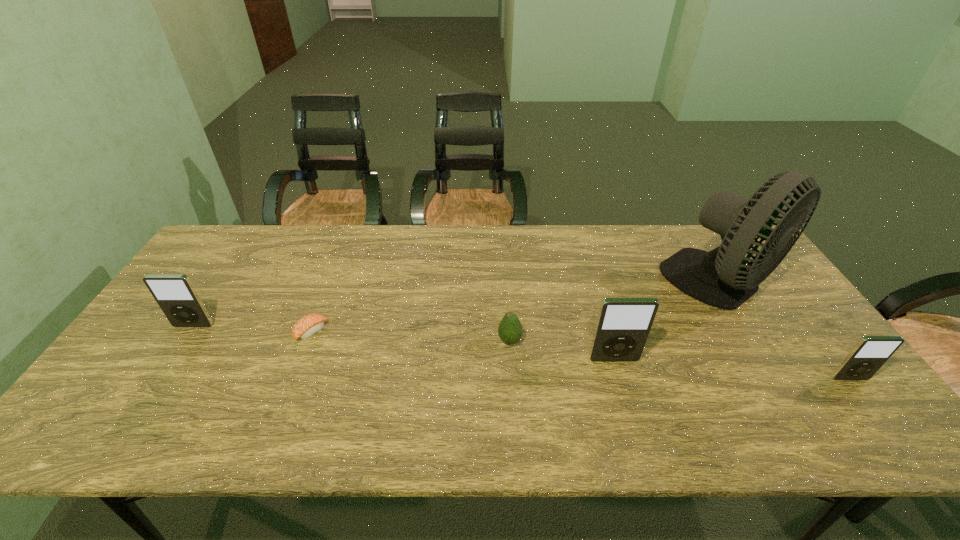
I want to click on the farthest iPod, so click(175, 294).

Find the location of a particular element. the leftmost iPod is located at coordinates (175, 294).

Where is `the second nearest object`? the second nearest object is located at coordinates (623, 325).

At what (x,y) coordinates should I click in order to perform the action: click on the third object from right to left. Please return your answer as a coordinate pair (x, y). This screenshot has width=960, height=540. Looking at the image, I should click on (623, 325).

At what (x,y) coordinates should I click in order to perform the action: click on the shortest iPod. Please return your answer as a coordinate pair (x, y). The image size is (960, 540). Looking at the image, I should click on (870, 353).

Where is `the rightmost iPod`? This screenshot has width=960, height=540. the rightmost iPod is located at coordinates (870, 353).

Identify the location of avocado. This screenshot has width=960, height=540. (510, 331).

I want to click on the fourth object from right to left, so click(x=510, y=331).

Find the location of a particular element. The image size is (960, 540). the tallest object is located at coordinates (720, 278).

Find the location of a particular element. The image size is (960, 540). the shortest object is located at coordinates (310, 324).